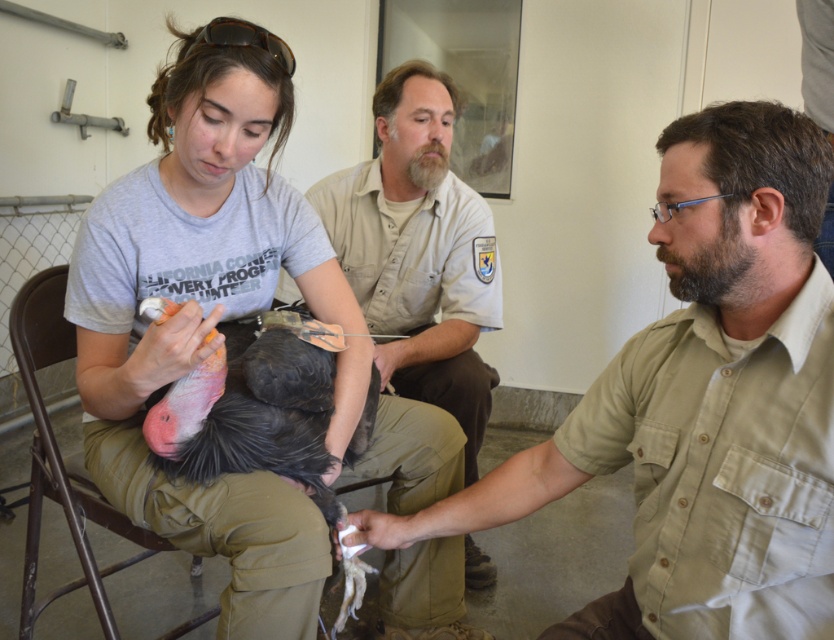
You are a photographer taking a picture of the scene. You notice the matte gray shirt at center and the khaki uniform shirt at center. Which one should you focus on if you want to capture the topmost clothing item?

The matte gray shirt at center is located above the khaki uniform shirt at center, so you should focus on the matte gray shirt at center to capture the topmost clothing item.

You are standing in the room and want to move from the khaki uniform shirt at center to the metallic brown chair at lower left. Can you walk directly to it without moving around any objects?

The metallic brown chair at lower left is behind the khaki uniform shirt at center, so you would need to move around the khaki uniform shirt at center to reach the metallic brown chair at lower left.

Based on the photo, you are a photographer standing in the room and want to take a photo of the matte gray shirt at center and the metallic brown chair at lower left. Which object is closer to the camera?

The matte gray shirt at center is positioned over the metallic brown chair at lower left, so the matte gray shirt at center is closer to the camera.